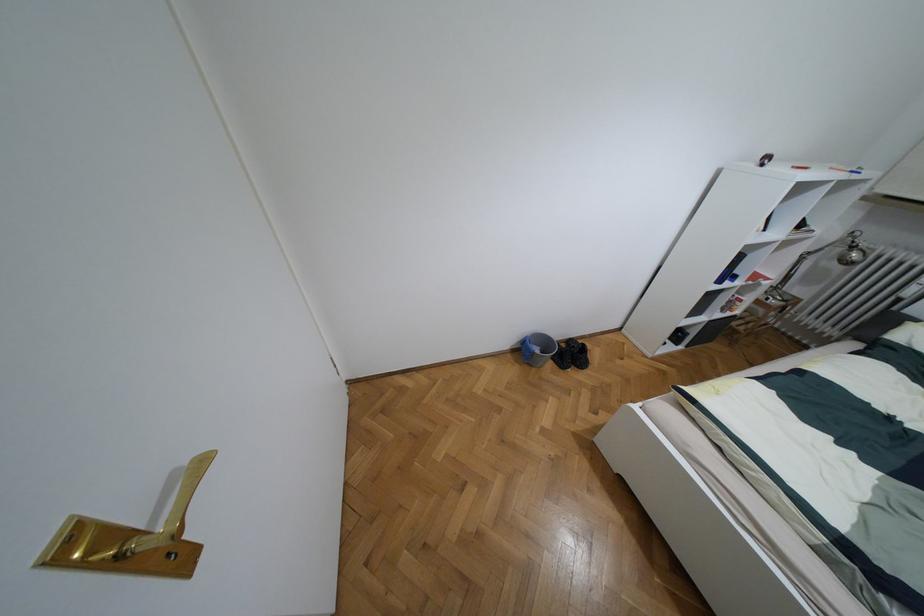
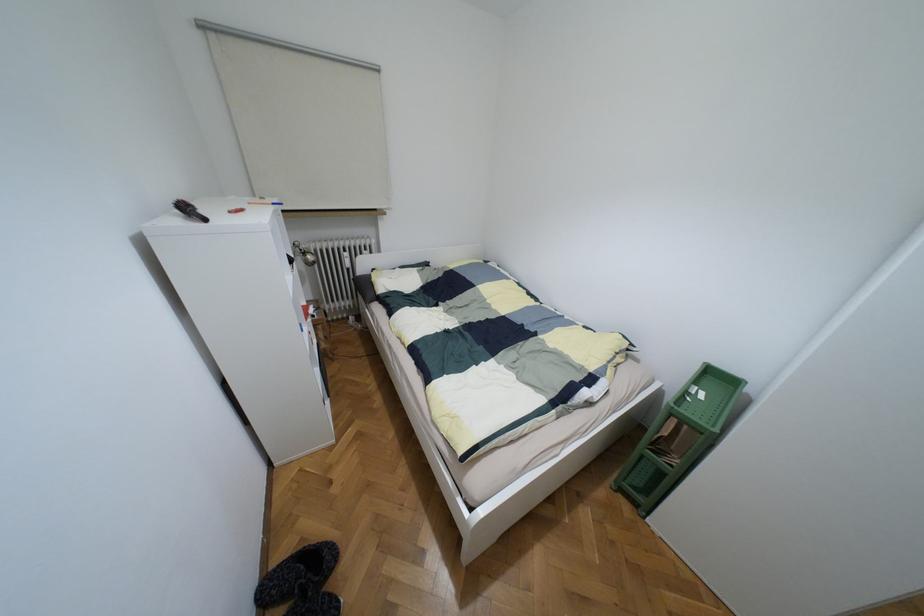
The images are taken continuously from a first-person perspective. In which direction is your viewpoint rotating?

The rotation direction of the camera is right-down.